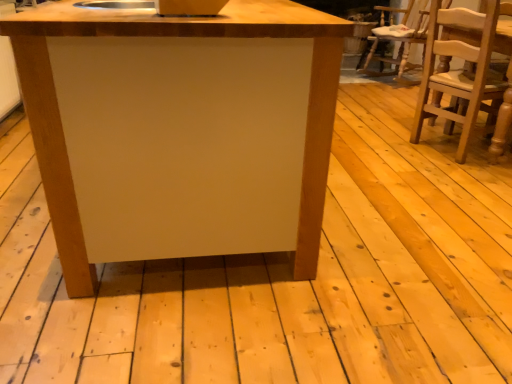
You are a GUI agent. You are given a task and a screenshot of the screen. Output one action in this format:
    pyautogui.click(x=<x>, y=<y>)
    Task: Click on the light brown wooden chair at right
    This screenshot has width=512, height=384.
    Given the screenshot: What is the action you would take?
    pyautogui.click(x=460, y=70)

The height and width of the screenshot is (384, 512). What do you see at coordinates (460, 70) in the screenshot?
I see `light brown wooden chair at right` at bounding box center [460, 70].

In order to face light brown wooden chair at right, should I rotate leftwards or rightwards?

Turn right approximately 26.307 degrees to face it.

The width and height of the screenshot is (512, 384). Find the location of `matte wood table at center`. matte wood table at center is located at coordinates (179, 140).

The image size is (512, 384). What do you see at coordinates (179, 140) in the screenshot?
I see `matte wood table at center` at bounding box center [179, 140].

Where is `light brown wooden chair at right`? Image resolution: width=512 pixels, height=384 pixels. light brown wooden chair at right is located at coordinates (460, 70).

Is matte wood table at center to the left of light brown wooden chair at right from the viewer's perspective?

Yes, matte wood table at center is to the left of light brown wooden chair at right.

Considering the relative positions of matte wood table at center and light brown wooden chair at right in the image provided, is matte wood table at center in front of light brown wooden chair at right?

Yes, matte wood table at center is closer to the viewer.

Does point (338, 39) come closer to viewer compared to point (474, 101)?

That is True.

From the image's perspective, is matte wood table at center under light brown wooden chair at right?

Yes, from the image's perspective, matte wood table at center is beneath light brown wooden chair at right.

From a real-world perspective, which is physically below, matte wood table at center or light brown wooden chair at right?

matte wood table at center is physically lower.

Looking at this image, between matte wood table at center and light brown wooden chair at right, which one has larger width?

With larger width is matte wood table at center.

Does matte wood table at center have a greater height compared to light brown wooden chair at right?

No.

Considering the sizes of objects matte wood table at center and light brown wooden chair at right in the image provided, who is bigger, matte wood table at center or light brown wooden chair at right?

With larger size is matte wood table at center.

Is light brown wooden chair at right located within matte wood table at center?

No, light brown wooden chair at right is not surrounded by matte wood table at center.

Is matte wood table at center not close to light brown wooden chair at right?

Indeed, matte wood table at center is not near light brown wooden chair at right.

Is matte wood table at center positioned with its back to light brown wooden chair at right?

No, matte wood table at center is not facing the opposite direction of light brown wooden chair at right.

How much distance is there between matte wood table at center and light brown wooden chair at right?

matte wood table at center is 1.70 meters from light brown wooden chair at right.

The image size is (512, 384). What are the coordinates of `table below the light brown wooden chair at right (from the image's perspective)` in the screenshot? It's located at (179, 140).

Is light brown wooden chair at right to the left of matte wood table at center from the viewer's perspective?

No.

Between light brown wooden chair at right and matte wood table at center, which one is positioned behind?

Positioned behind is light brown wooden chair at right.

Is point (432, 50) farther from viewer compared to point (128, 36)?

Yes, point (432, 50) is farther from viewer.

From the image's perspective, which object appears higher, light brown wooden chair at right or matte wood table at center?

light brown wooden chair at right is shown above in the image.

In the scene shown: From a real-world perspective, which object rests below the other?

matte wood table at center.

Is light brown wooden chair at right thinner than matte wood table at center?

Yes, light brown wooden chair at right is thinner than matte wood table at center.

Does light brown wooden chair at right have a greater height compared to matte wood table at center?

Yes, light brown wooden chair at right is taller than matte wood table at center.

Can you confirm if light brown wooden chair at right is bigger than matte wood table at center?

No.

Consider the image. Does light brown wooden chair at right contain matte wood table at center?

No.

In the scene shown: Are light brown wooden chair at right and matte wood table at center located far from each other?

Yes.

Looking at this image, is light brown wooden chair at right facing away from matte wood table at center?

Correct, light brown wooden chair at right is looking away from matte wood table at center.

Can you tell me how much light brown wooden chair at right and matte wood table at center differ in facing direction?

The angular difference between light brown wooden chair at right and matte wood table at center is 20.7 degrees.

Where is `chair behind the matte wood table at center`? chair behind the matte wood table at center is located at coordinates (460, 70).

Identify the location of chair lying above the matte wood table at center (from the image's perspective). [x=460, y=70].

Find the location of a particular element. Image resolution: width=512 pixels, height=384 pixels. table below the light brown wooden chair at right (from the image's perspective) is located at coordinates (179, 140).